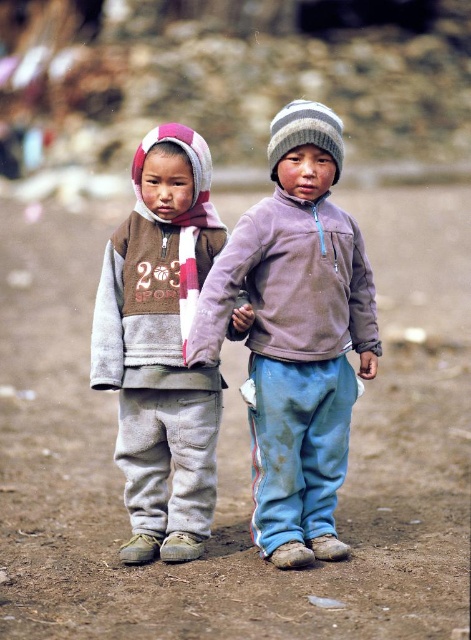
Does point (151, 355) come closer to viewer compared to point (298, 230)?

No, (151, 355) is behind (298, 230).

Does gray fleece jacket at left appear over matte purple sweatshirt at center?

No, gray fleece jacket at left is not above matte purple sweatshirt at center.

Between point (191, 381) and point (285, 332), which one is positioned behind?

Positioned behind is point (191, 381).

Where is `gray fleece jacket at left`? The image size is (471, 640). gray fleece jacket at left is located at coordinates (162, 348).

Is light purple fleece jacket at center wider than matte purple sweatshirt at center?

No.

Is light purple fleece jacket at center in front of matte purple sweatshirt at center?

That is False.

Is point (269, 513) positioned in front of point (284, 294)?

No, (269, 513) is behind (284, 294).

The height and width of the screenshot is (640, 471). What are the coordinates of `light purple fleece jacket at center` in the screenshot? It's located at (297, 333).

Does light purple fleece jacket at center have a lesser height compared to gray fleece jacket at left?

No, light purple fleece jacket at center is not shorter than gray fleece jacket at left.

Is light purple fleece jacket at center smaller than gray fleece jacket at left?

No.

In order to click on light purple fleece jacket at center in this screenshot , I will do `click(297, 333)`.